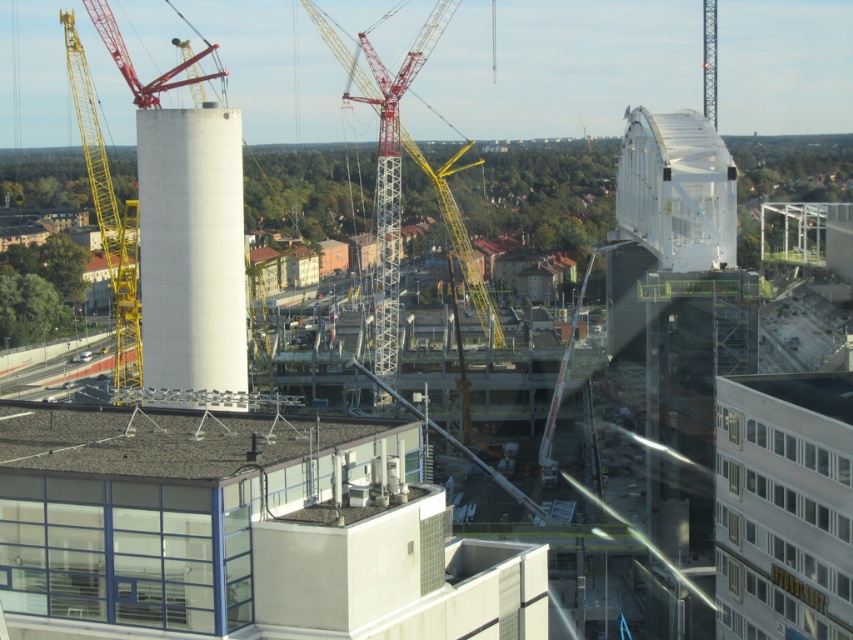
Is point (212, 276) positioned behind point (78, 70)?

No.

Is white smooth cylinder at center to the left of yellow metallic crane at left from the viewer's perspective?

Incorrect, white smooth cylinder at center is not on the left side of yellow metallic crane at left.

Measure the distance between point (x=190, y=248) and camera.

They are 458.90 feet apart.

Where is `white smooth cylinder at center`? The width and height of the screenshot is (853, 640). white smooth cylinder at center is located at coordinates (190, 248).

Does yellow metal crane at center have a lesser width compared to yellow metallic crane at left?

No.

Describe the element at coordinates (399, 179) in the screenshot. I see `yellow metal crane at center` at that location.

Locate an element on the screen. Image resolution: width=853 pixels, height=640 pixels. yellow metal crane at center is located at coordinates (399, 179).

Which is in front, point (241, 147) or point (700, 262)?

Point (241, 147)

In the scene shown: Which is above, white smooth cylinder at center or transparent glass bridge at upper right?

transparent glass bridge at upper right is above.

Locate an element on the screen. The height and width of the screenshot is (640, 853). white smooth cylinder at center is located at coordinates (190, 248).